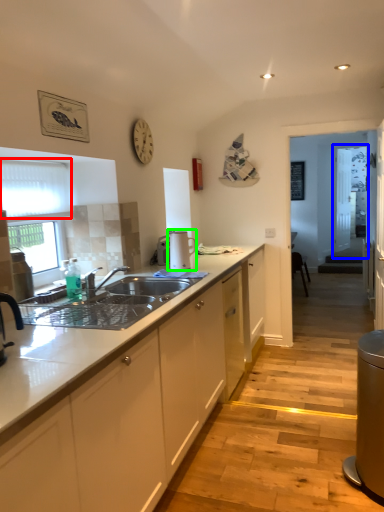
Question: Which object is the farthest from window screen (highlighted by a red box)? Choose among these: glass door (highlighted by a blue box) or appliance (highlighted by a green box).

Choices:
 (A) glass door
 (B) appliance

Answer: (A)